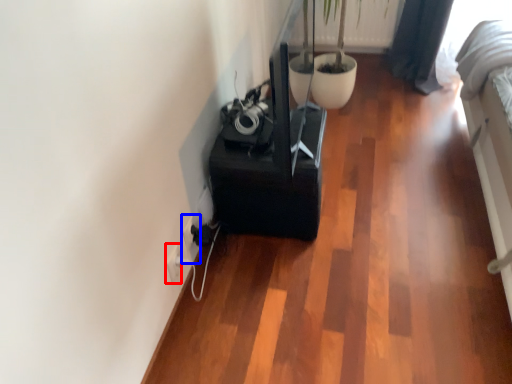
Question: Which of the following is the closest to the observer, electric outlet (highlighted by a red box) or electric outlet (highlighted by a blue box)?

Choices:
 (A) electric outlet
 (B) electric outlet

Answer: (A)